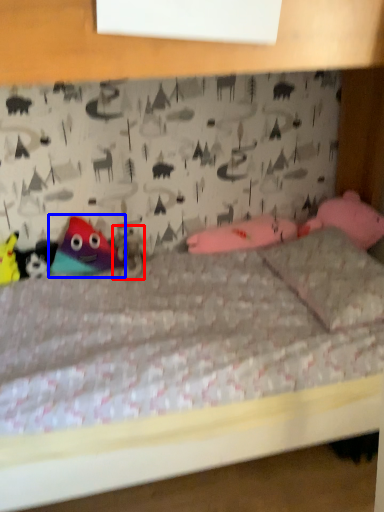
Question: Which of the following is the farthest to the observer, animal (highlighted by a red box) or toy (highlighted by a blue box)?

Choices:
 (A) animal
 (B) toy

Answer: (A)